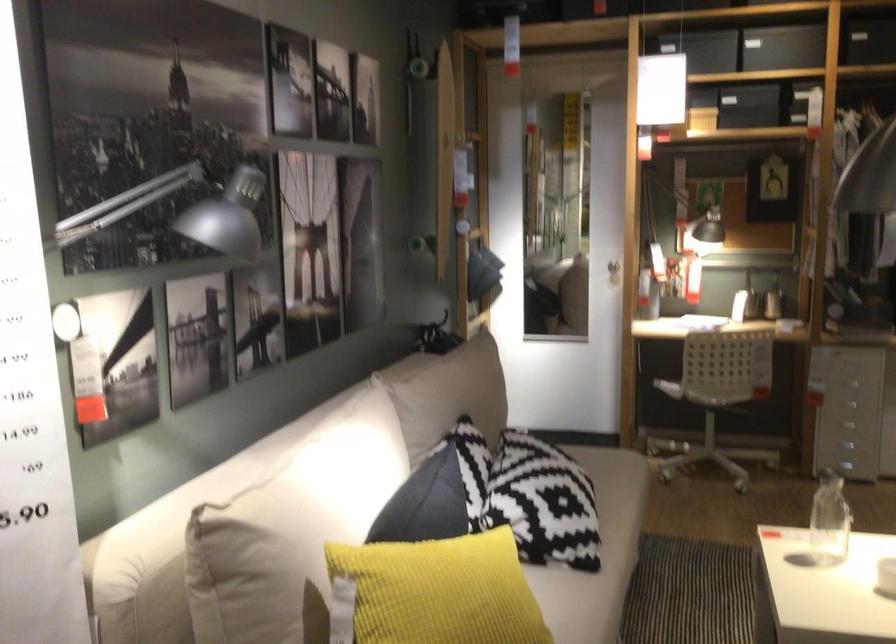
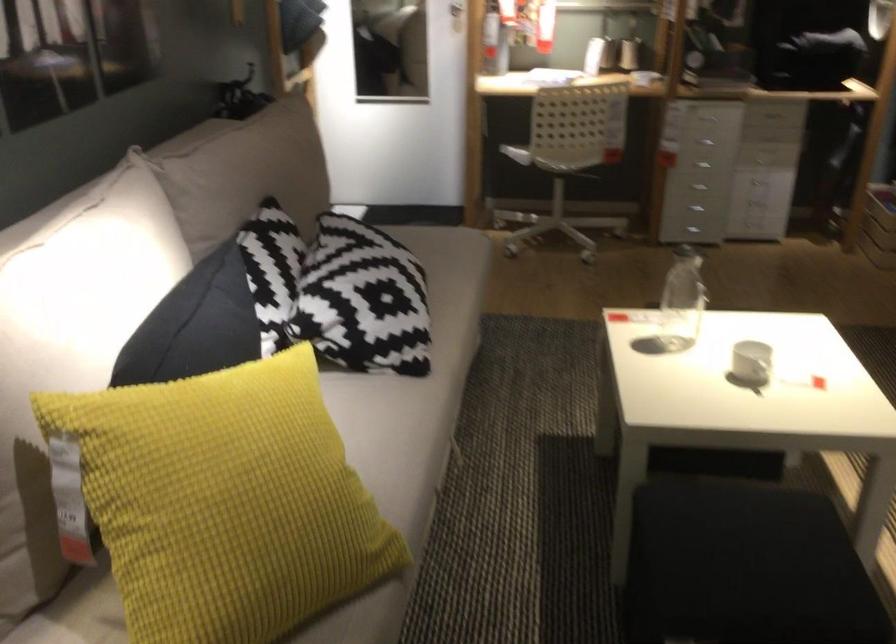
Question: Based on the continuous images, in which direction is the camera rotating? Reply with the corresponding letter.

Choices:
 (A) Left
 (B) Right
 (C) Up
 (D) Down

Answer: (D)